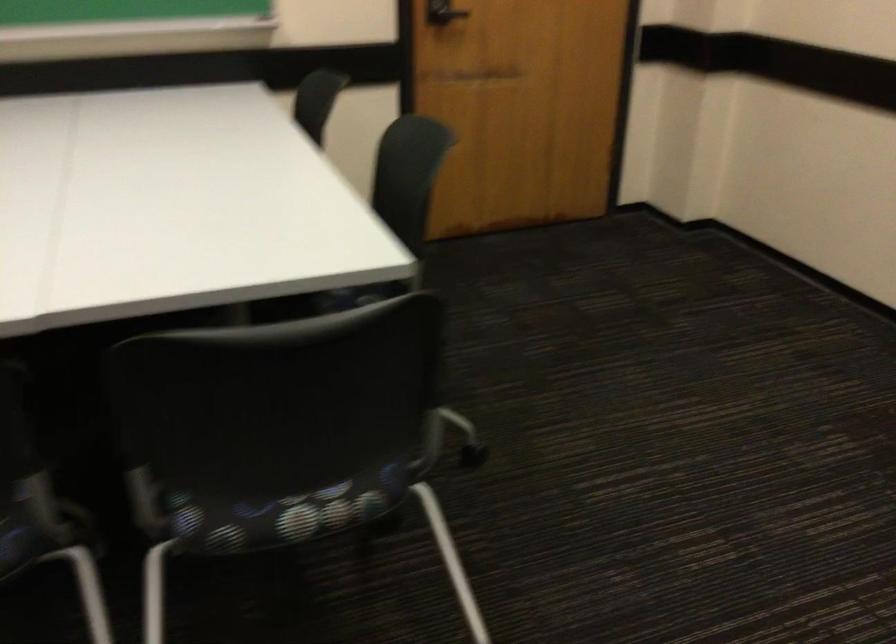
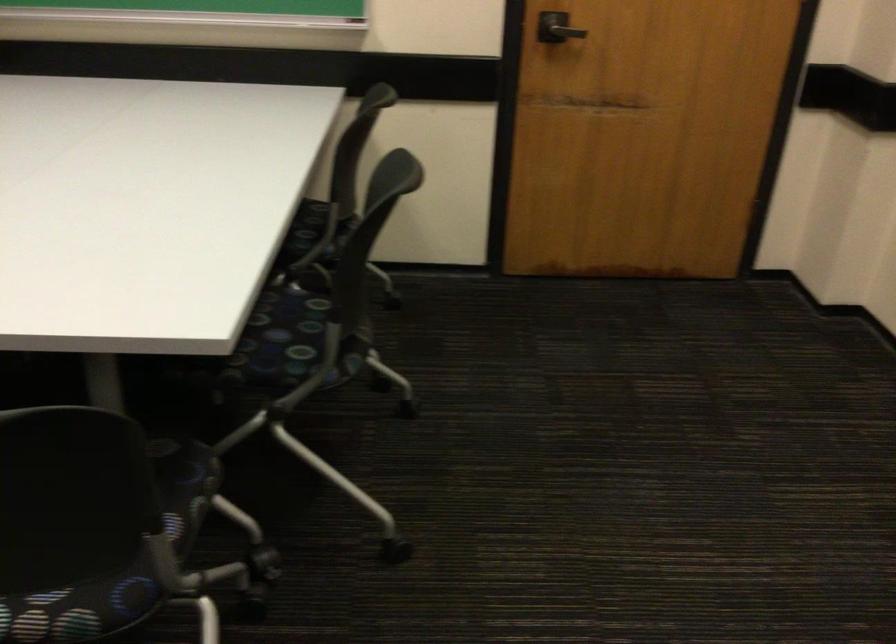
Question: The first image is from the beginning of the video and the second image is from the end. How did the camera likely rotate when shooting the video?

Choices:
 (A) Left
 (B) Right
 (C) Up
 (D) Down

Answer: (A)